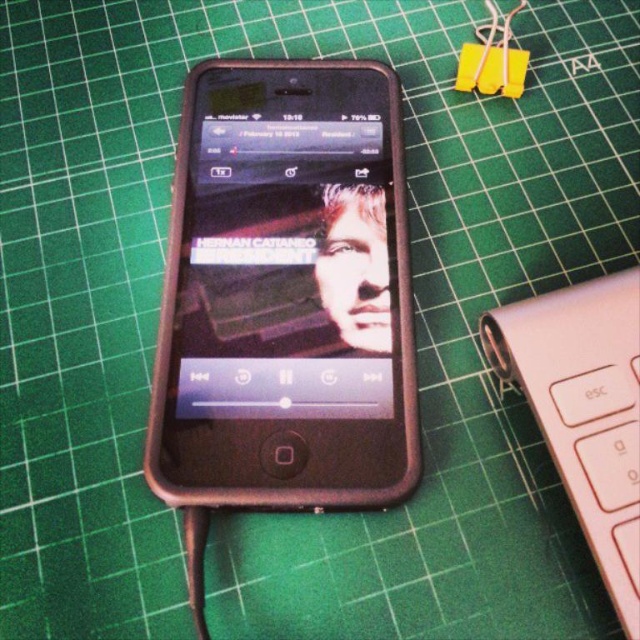
You are looking at the smartphone screen and notice two points marked on the screen. The first point is at coordinates point(x=371, y=163) and the second is at point(x=609, y=404). Which point is closer to you as you look at the screen?

Point(x=371, y=163) is behind point(x=609, y=404), so the point closer to you would be point(x=609, y=404).

You are organizing a desk and need to place the black matte smartphone at center and the pink matte keyboard at lower right. According to the image, which object is located to the left of the other?

The black matte smartphone at center is positioned on the left side of pink matte keyboard at lower right, so the smartphone is to the left of the keyboard.

You are setting up a desk and want to place the black matte smartphone at center and the pink matte keyboard at lower right. Given that the desk has limited vertical space, which object might be more challenging to fit vertically?

The black matte smartphone at center has a greater height compared to the pink matte keyboard at lower right, so it would be more challenging to fit vertically due to its larger height.